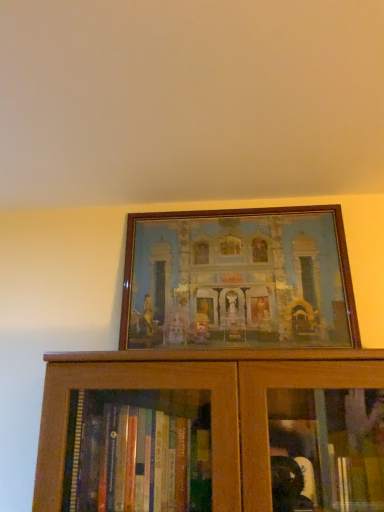
Locate an element on the screen. The height and width of the screenshot is (512, 384). wooden picture frame at upper center is located at coordinates click(x=238, y=279).

This screenshot has height=512, width=384. What do you see at coordinates (238, 279) in the screenshot?
I see `wooden picture frame at upper center` at bounding box center [238, 279].

What is the approximate height of wooden picture frame at upper center?

16.14 inches.

The width and height of the screenshot is (384, 512). What are the coordinates of `wooden picture frame at upper center` in the screenshot? It's located at (238, 279).